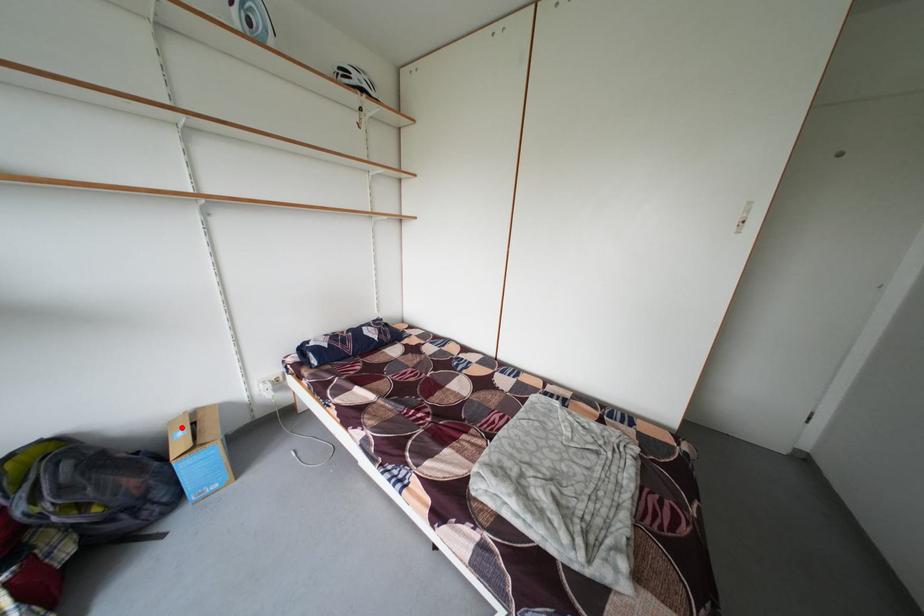
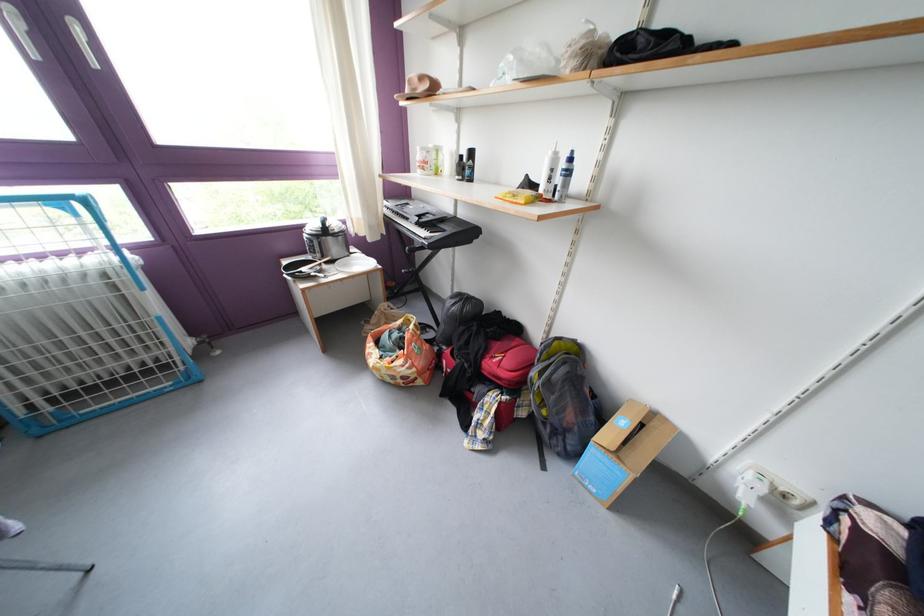
In the second image, find the point that corresponds to the highlighted location in the first image.

(641, 407)